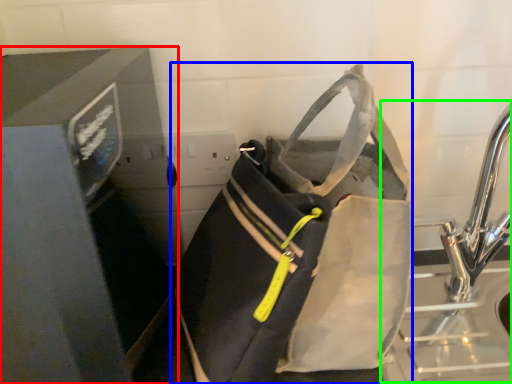
Question: Which is farther away from appliance (highlighted by a red box)? luggage and bags (highlighted by a blue box) or sink (highlighted by a green box)?

Choices:
 (A) luggage and bags
 (B) sink

Answer: (B)